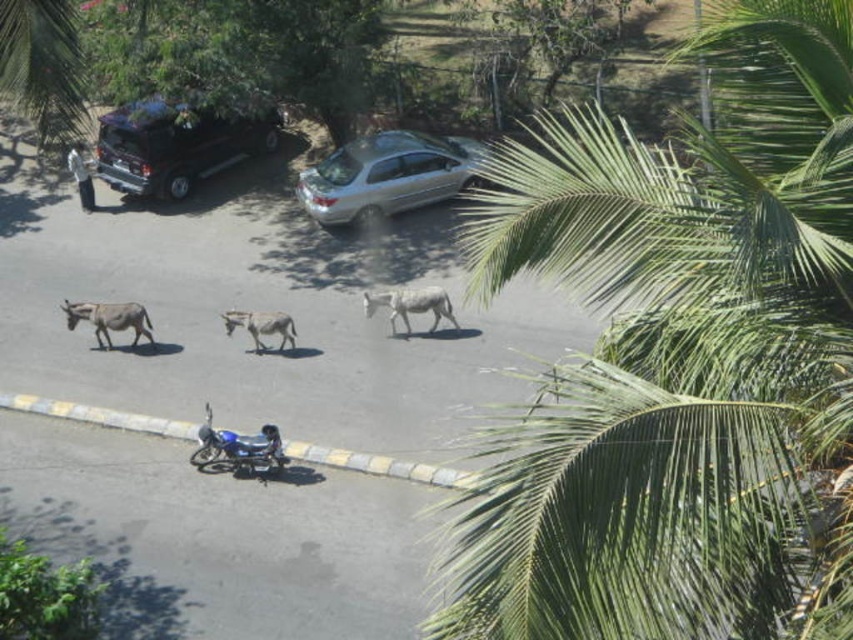
Question: Based on their relative distances, which object is farther from the metallic blue motorcycle at upper left?

Choices:
 (A) dark brown matte suv at upper left
 (B) green leafy palm tree at upper left
 (C) silver metallic sedan at center

Answer: (B)

Question: Which of the following is the farthest from the observer?

Choices:
 (A) (828, 616)
 (B) (456, 163)
 (C) (267, 426)

Answer: (B)

Question: Where is silver metallic sedan at center located in relation to gray matte donkey at left in the image?

Choices:
 (A) above
 (B) below

Answer: (A)

Question: Which point is closer to the camera taking this photo?

Choices:
 (A) [x=96, y=147]
 (B) [x=78, y=83]
 (C) [x=76, y=164]
 (D) [x=445, y=301]

Answer: (B)

Question: Is gray matte donkey at left bigger than white matte goat at center?

Choices:
 (A) no
 (B) yes

Answer: (B)

Question: Does dark brown matte suv at upper left come in front of blue metallic motorcycle at lower center?

Choices:
 (A) yes
 (B) no

Answer: (B)